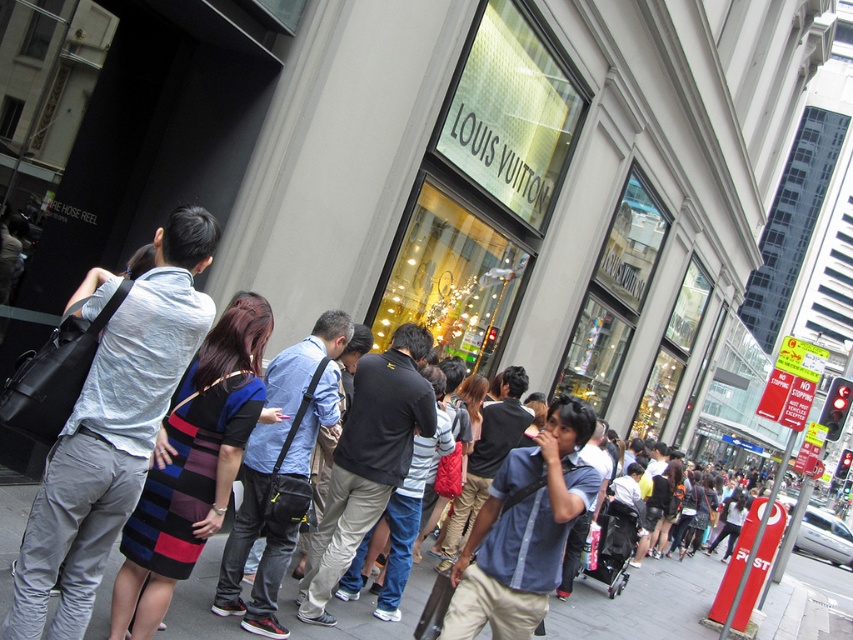
Between smooth concrete pavement at center and blue denim shirt at center, which one appears on the right side from the viewer's perspective?

From the viewer's perspective, smooth concrete pavement at center appears more on the right side.

This screenshot has width=853, height=640. What do you see at coordinates (641, 604) in the screenshot?
I see `smooth concrete pavement at center` at bounding box center [641, 604].

This screenshot has height=640, width=853. I want to click on smooth concrete pavement at center, so click(x=641, y=604).

Can you confirm if blue striped dress at center is shorter than multicolored knit dress at center?

No, blue striped dress at center is not shorter than multicolored knit dress at center.

Is blue striped dress at center taller than multicolored knit dress at center?

Yes.

Is point (172, 604) positioned after point (193, 364)?

Yes, point (172, 604) is behind point (193, 364).

Locate an element on the screen. The width and height of the screenshot is (853, 640). blue striped dress at center is located at coordinates (93, 474).

Can you confirm if blue striped dress at center is positioned to the right of blue denim shirt at center?

In fact, blue striped dress at center is to the left of blue denim shirt at center.

Does blue striped dress at center appear over blue denim shirt at center?

Correct, blue striped dress at center is located above blue denim shirt at center.

This screenshot has width=853, height=640. In order to click on blue striped dress at center in this screenshot , I will do `click(93, 474)`.